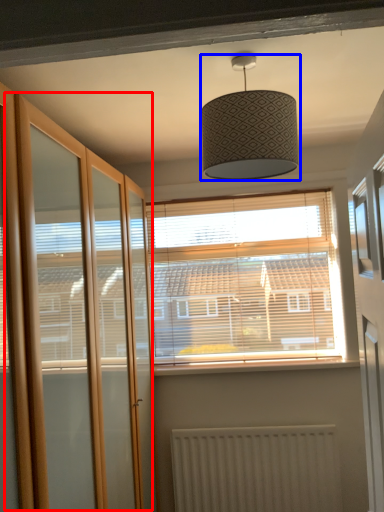
Question: Which of the following is the closest to the observer, screen door (highlighted by a red box) or lamp (highlighted by a blue box)?

Choices:
 (A) screen door
 (B) lamp

Answer: (A)